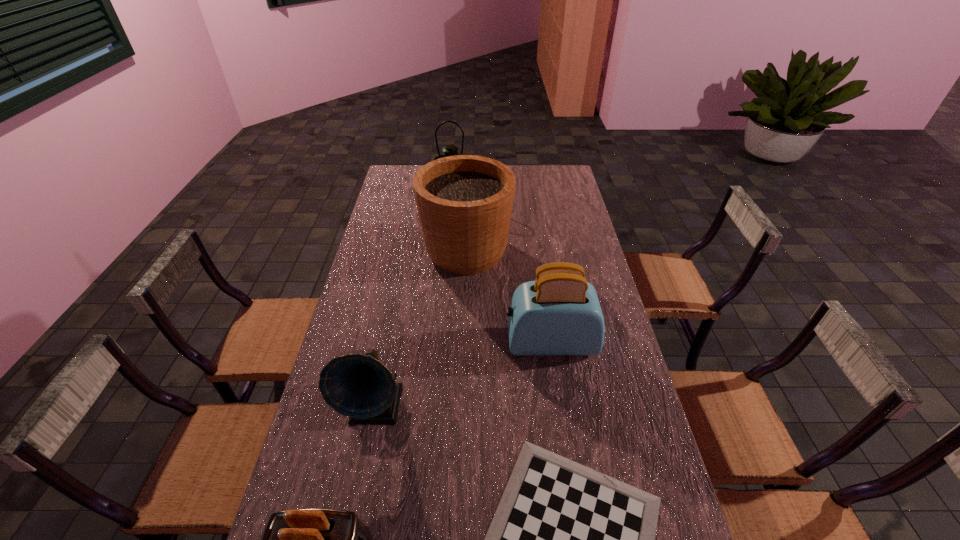
Where is `the farthest object`? the farthest object is located at coordinates (449, 150).

Locate an element on the screen. the fifth nearest object is located at coordinates (464, 202).

Locate an element on the screen. the farther toaster is located at coordinates (559, 313).

Locate an element on the screen. The image size is (960, 540). the fourth nearest object is located at coordinates (559, 313).

Locate an element on the screen. This screenshot has height=540, width=960. phonograph_record is located at coordinates (360, 387).

I want to click on free space located 0.380m on the side where the farthest object emits light, so click(447, 253).

This screenshot has width=960, height=540. What are the coordinates of `vacant area situated 0.220m on the left of the fifth nearest object` in the screenshot? It's located at (366, 252).

Find the location of `vacant space located 0.100m on the side of the taller toaster with the lever`. vacant space located 0.100m on the side of the taller toaster with the lever is located at coordinates (473, 342).

Where is `free space located on the side of the taller toaster with the lever`? The height and width of the screenshot is (540, 960). free space located on the side of the taller toaster with the lever is located at coordinates (448, 342).

At what (x,y) coordinates should I click in order to perform the action: click on vacant area located 0.300m on the side of the taller toaster with the lever. Please return your answer as a coordinate pair (x, y). The width and height of the screenshot is (960, 540). Looking at the image, I should click on (410, 342).